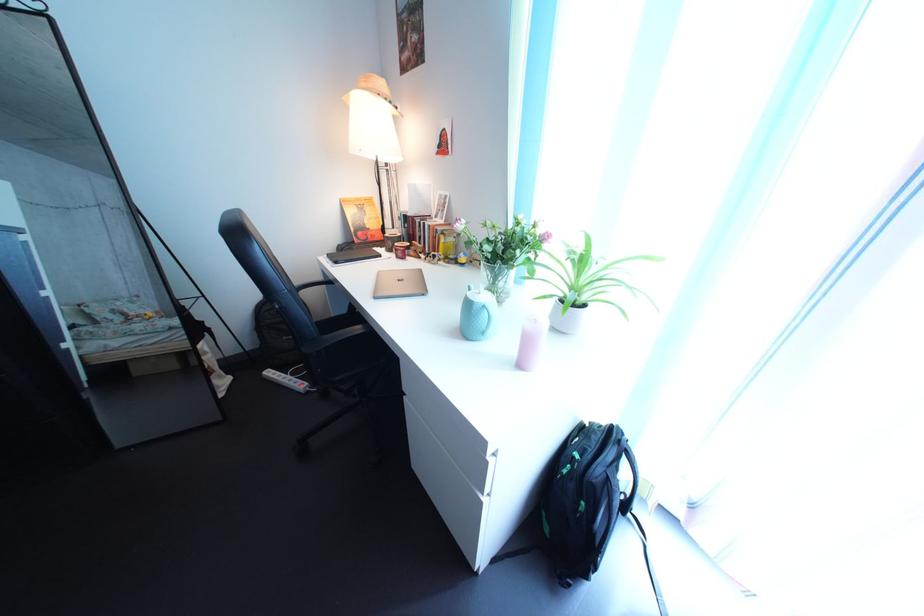
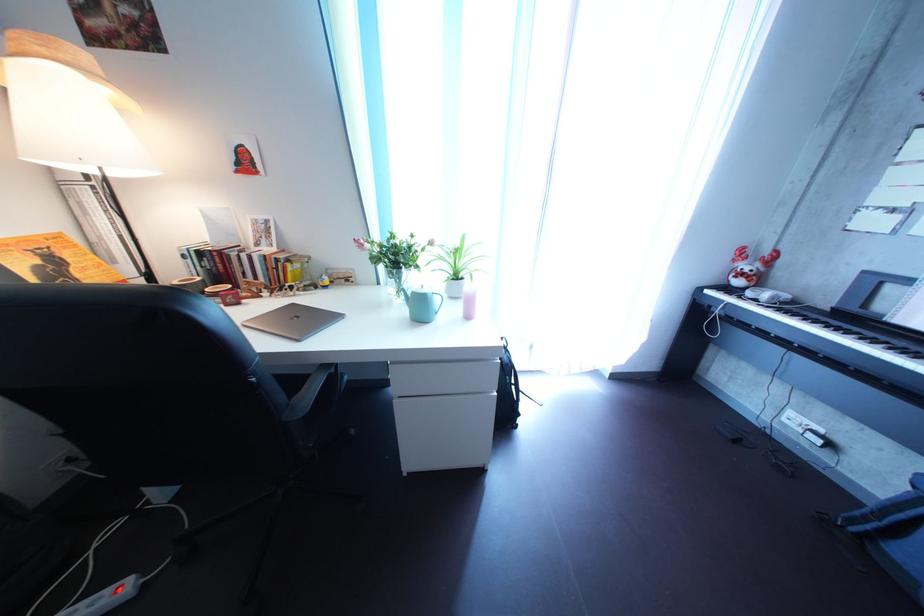
Find the pixel in the second image that matches (435,278) in the first image.

(308, 313)